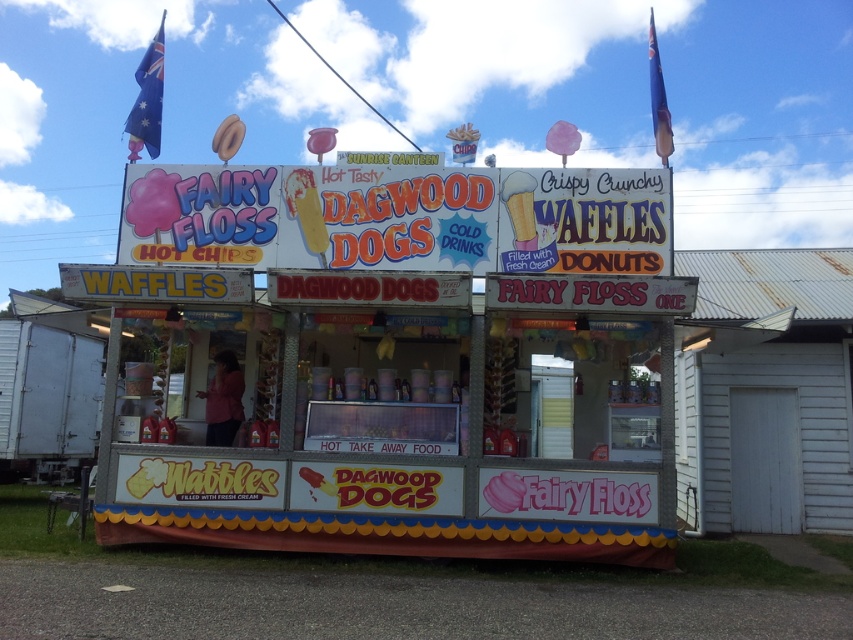
Is matte plastic ticket booth at center below matte plastic cotton candy at upper center?

Yes.

Can you confirm if matte plastic ticket booth at center is bigger than matte plastic cotton candy at upper center?

Incorrect, matte plastic ticket booth at center is not larger than matte plastic cotton candy at upper center.

Is point (619, 253) more distant than point (231, 116)?

That is False.

Identify the location of matte plastic ticket booth at center. (421, 362).

Can you confirm if pink fabric vendor at center is bigger than matte plastic cotton candy at upper center?

Actually, pink fabric vendor at center might be smaller than matte plastic cotton candy at upper center.

Does point (223, 356) come closer to viewer compared to point (236, 122)?

Yes, point (223, 356) is closer to viewer.

The width and height of the screenshot is (853, 640). In order to click on pink fabric vendor at center in this screenshot , I will do `click(223, 401)`.

Who is more forward, (635, 337) or (219, 406)?

Point (635, 337) is more forward.

Is matte plastic ticket booth at center above pink fabric vendor at center?

Incorrect, matte plastic ticket booth at center is not positioned above pink fabric vendor at center.

Which is in front, point (286, 358) or point (236, 410)?

Point (286, 358) is in front.

Locate an element on the screen. matte plastic ticket booth at center is located at coordinates (421, 362).